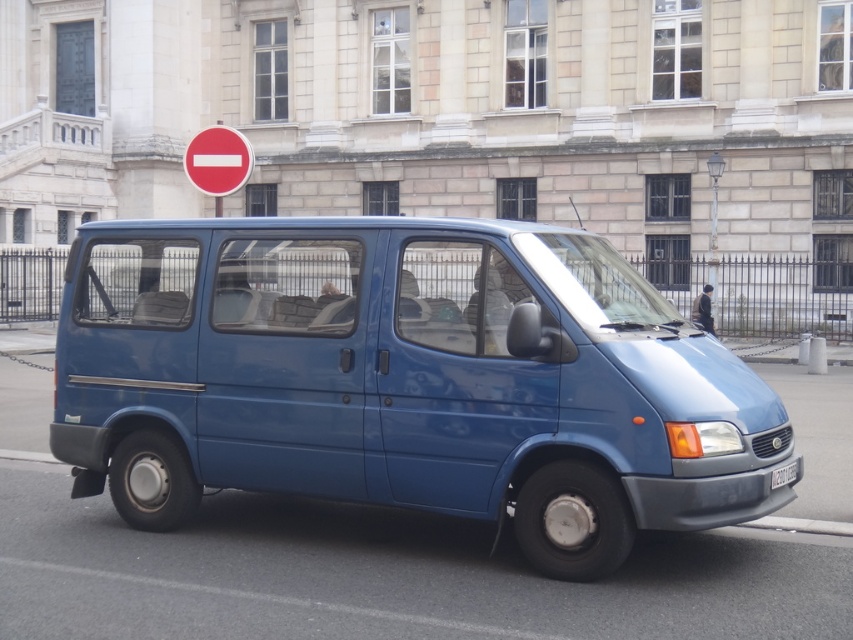
Question: Can you confirm if blue matte van at center is positioned above black plastic license plate at center?

Choices:
 (A) no
 (B) yes

Answer: (B)

Question: Estimate the real-world distances between objects in this image. Which object is farther from the black plastic license plate at center?

Choices:
 (A) red matte sign at upper center
 (B) blue matte van at center

Answer: (A)

Question: Which is nearer to the red matte sign at upper center?

Choices:
 (A) blue matte van at center
 (B) black plastic license plate at center

Answer: (A)

Question: In this image, where is blue matte van at center located relative to red matte sign at upper center?

Choices:
 (A) left
 (B) right

Answer: (B)

Question: Can you confirm if blue matte van at center is positioned to the left of black plastic license plate at center?

Choices:
 (A) no
 (B) yes

Answer: (B)

Question: Which point is farther to the camera?

Choices:
 (A) black plastic license plate at center
 (B) red matte sign at upper center

Answer: (B)